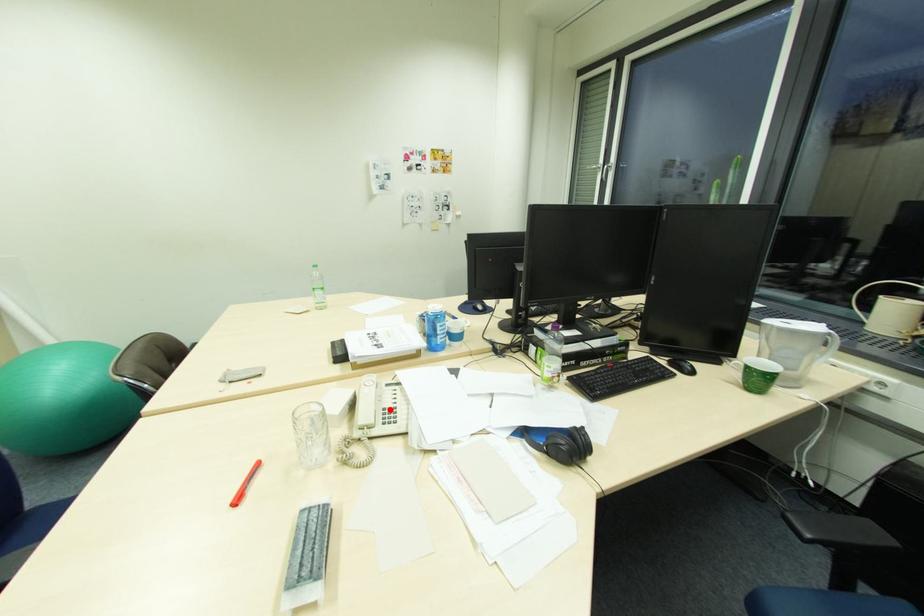
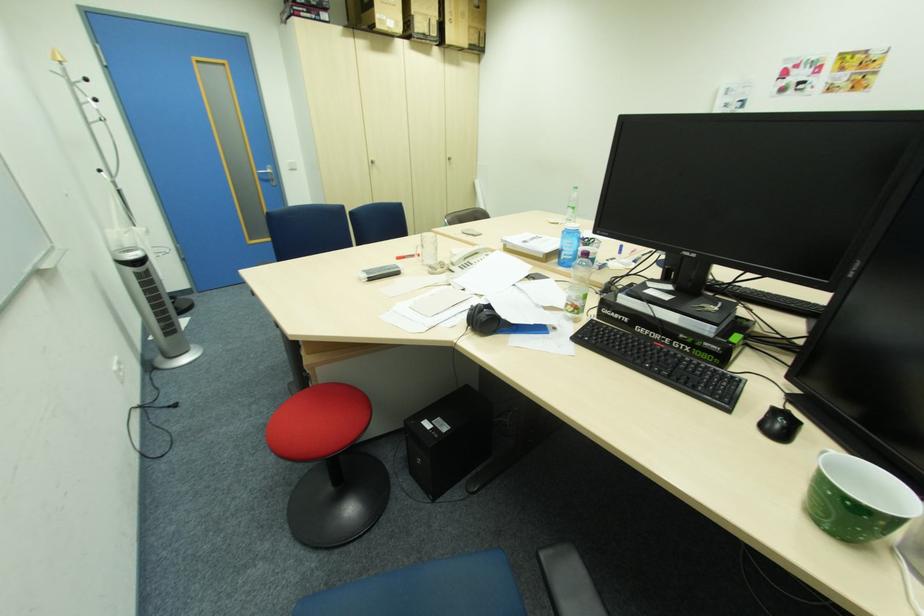
The point at the highlighted location is marked in the first image. Where is the corresponding point in the second image?

(475, 262)